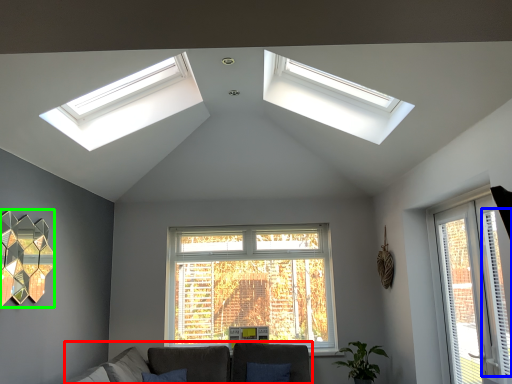
Question: Which is farther away from couch (highlighted by a red box)? curtain (highlighted by a blue box) or lamp (highlighted by a green box)?

Choices:
 (A) curtain
 (B) lamp

Answer: (A)